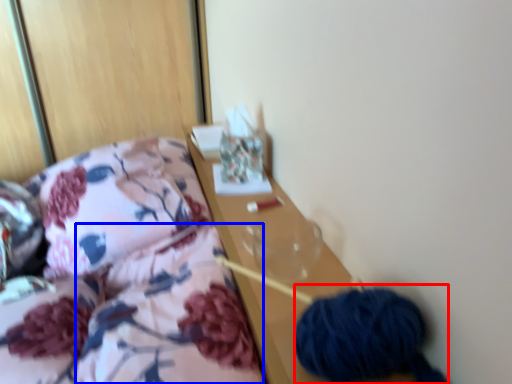
Question: Which point is further to the camera, material (highlighted by a red box) or quilt (highlighted by a blue box)?

Choices:
 (A) material
 (B) quilt

Answer: (A)